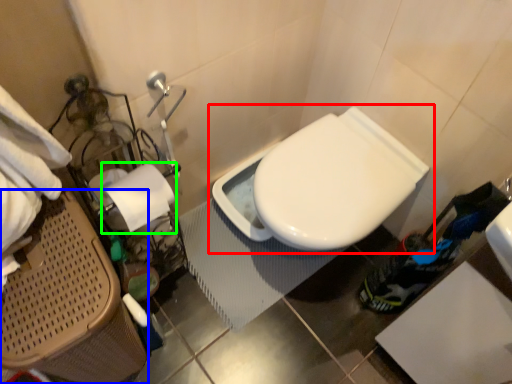
Question: Which object is the farthest from toilet (highlighted by a red box)? Choose among these: laundry basket (highlighted by a blue box) or toilet paper (highlighted by a green box).

Choices:
 (A) laundry basket
 (B) toilet paper

Answer: (A)